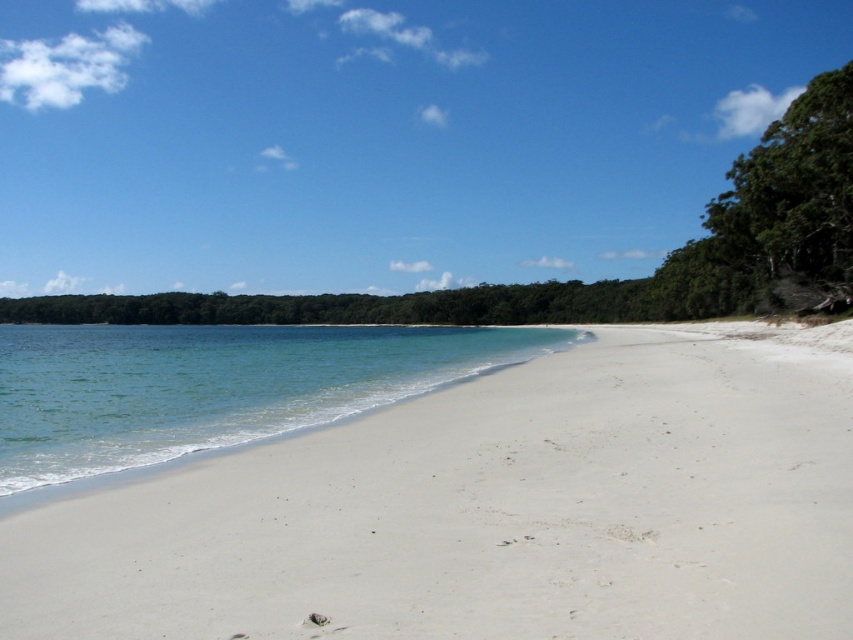
Looking at this image, you are standing at the point marked as point (674, 552). You want to walk to the water. How many steps would you need to take if each step covers 2.5 feet?

The distance between the two points is 18.65 feet. Each step covers 2.5 feet, so dividing 18.65 by 2.5 gives approximately 7.46 steps. Since you can only take whole steps, you would need to take 8 steps to reach the water.

You are standing on the white sandy beach at center and want to reach the clear water at lower left. Which direction should you move to get there?

The white sandy beach at center is positioned on the right side of clear water at lower left. To reach the clear water at lower left, you should move to the left.

You are planning to build a sandcastle on the white sandy beach at center and want to ensure there is enough space. Given that the clear water at lower left is larger, can you determine which area is more suitable for a larger structure?

The clear water at lower left is larger than the white sandy beach at center, so the clear water at lower left would be more suitable for a larger structure.